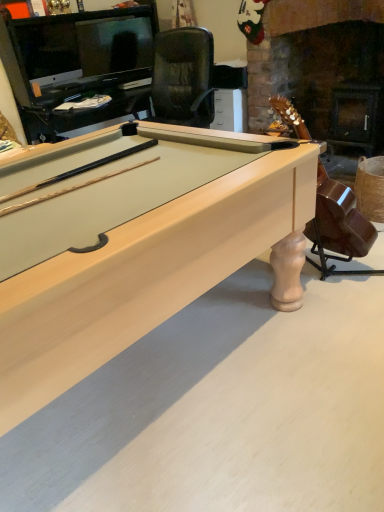
The width and height of the screenshot is (384, 512). I want to click on vacant region to the left of matte brown guitar at center-right, so click(x=251, y=304).